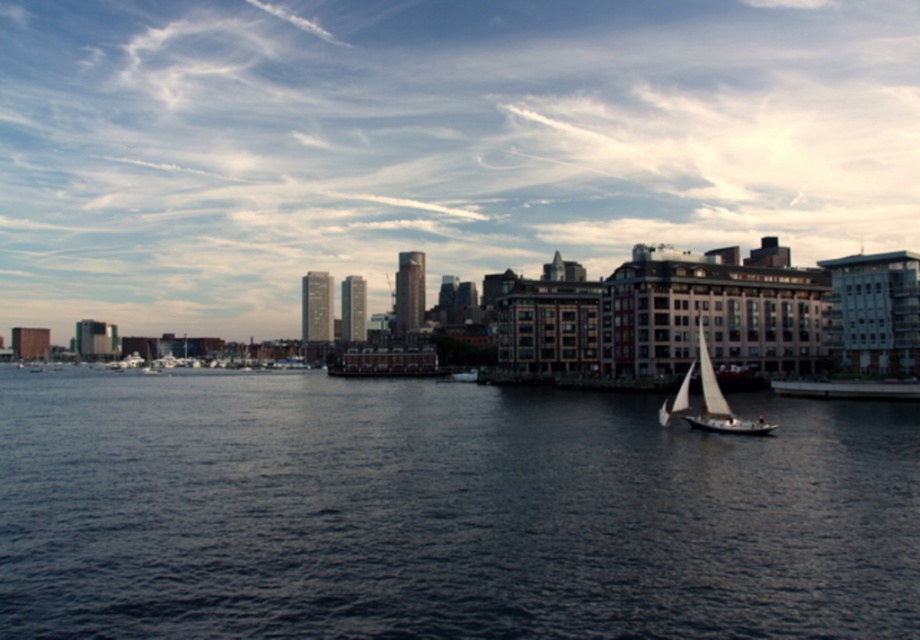
Question: Is dark blue water at center bigger than white sailboat at lower right?

Choices:
 (A) yes
 (B) no

Answer: (A)

Question: Does dark blue water at center come behind white sailboat at lower right?

Choices:
 (A) no
 (B) yes

Answer: (A)

Question: Is dark blue water at center smaller than white sailboat at lower right?

Choices:
 (A) yes
 (B) no

Answer: (B)

Question: Which point is farther to the camera?

Choices:
 (A) (535, 518)
 (B) (705, 412)

Answer: (B)

Question: Which point is closer to the camera?

Choices:
 (A) dark blue water at center
 (B) white sailboat at lower right

Answer: (A)